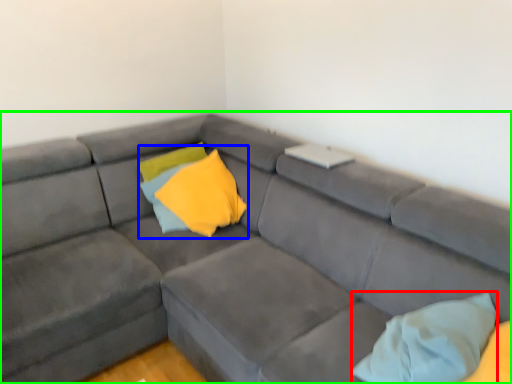
Question: Which object is positioned farthest from pillow (highlighted by a red box)? Select from pillow (highlighted by a blue box) and studio couch (highlighted by a green box).

Choices:
 (A) pillow
 (B) studio couch

Answer: (A)